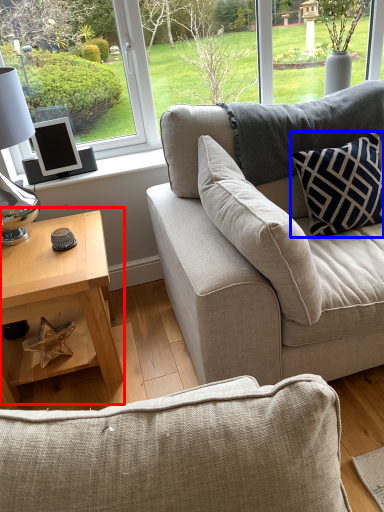
Question: Among these objects, which one is nearest to the camera, coffee table (highlighted by a red box) or pillow (highlighted by a blue box)?

Choices:
 (A) coffee table
 (B) pillow

Answer: (A)